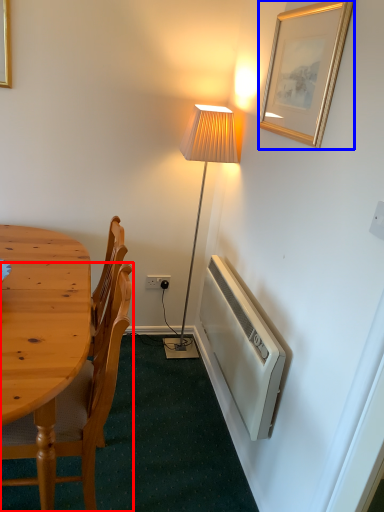
Question: Which of the following is the farthest to the observer, chair (highlighted by a red box) or picture frame (highlighted by a blue box)?

Choices:
 (A) chair
 (B) picture frame

Answer: (B)